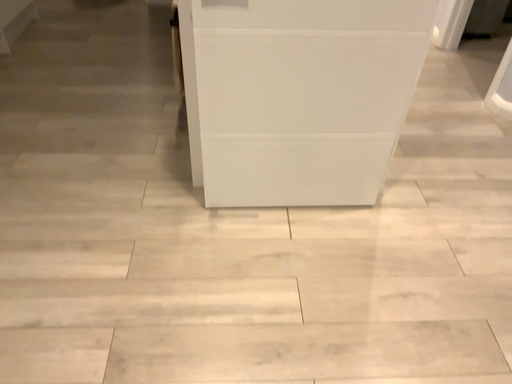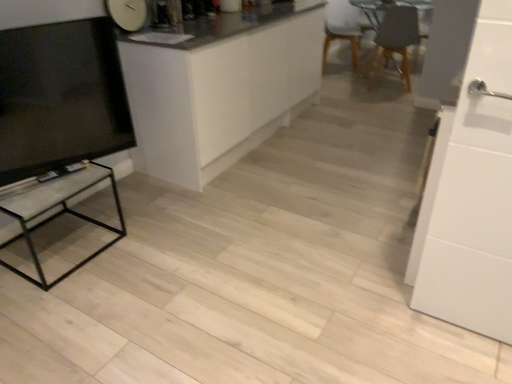
Question: How did the camera likely rotate when shooting the video?

Choices:
 (A) rotated upward
 (B) rotated downward

Answer: (A)